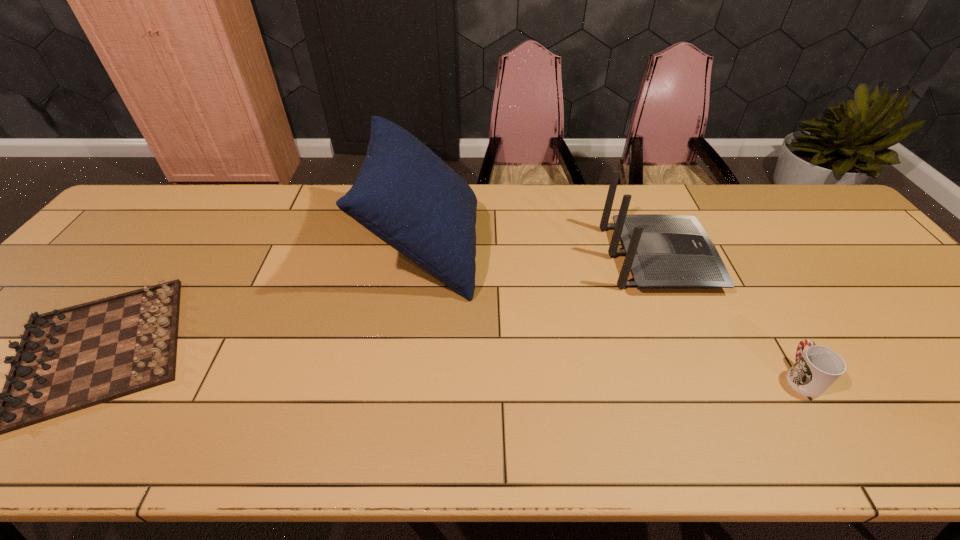
Where is `the tallest object`? the tallest object is located at coordinates (407, 196).

Image resolution: width=960 pixels, height=540 pixels. In order to click on the second object from left to right in this screenshot , I will do `click(407, 196)`.

This screenshot has width=960, height=540. I want to click on router, so click(662, 251).

At what (x,y) coordinates should I click in order to perform the action: click on the third shortest object. Please return your answer as a coordinate pair (x, y). The height and width of the screenshot is (540, 960). Looking at the image, I should click on (662, 251).

Image resolution: width=960 pixels, height=540 pixels. Identify the location of cup. (815, 370).

Where is `vacant space situated on the facing side of the cushion`? Image resolution: width=960 pixels, height=540 pixels. vacant space situated on the facing side of the cushion is located at coordinates (498, 248).

I want to click on vacant area situated on the front-facing side of the second object from right to left, so click(x=812, y=258).

Identify the location of vacant space located 0.370m on the side of the cup where the handle is located. (726, 249).

I want to click on free region located on the side of the cup where the handle is located, so [742, 276].

Identify the location of free space located on the side of the cup where the handle is located. The image size is (960, 540). point(755,298).